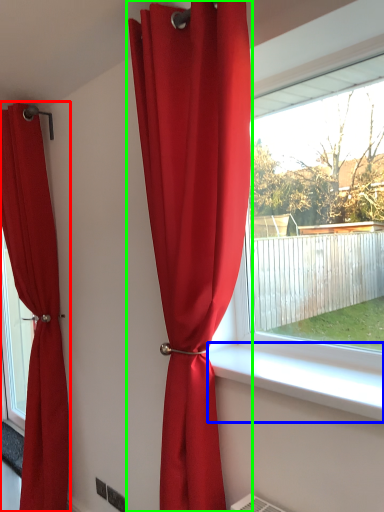
Question: Which object is the farthest from curtain (highlighted by a red box)? Choose among these: window sill (highlighted by a blue box) or curtain (highlighted by a green box).

Choices:
 (A) window sill
 (B) curtain

Answer: (A)